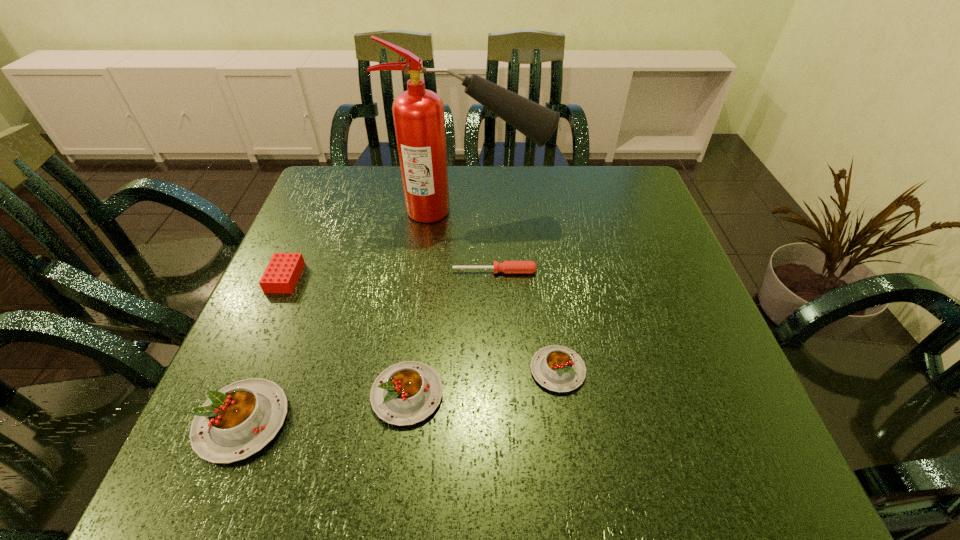
At what (x,y) coordinates should I click in order to perform the action: click on vacant space that's between the shortest object and the shortest pudding. Please return your answer as a coordinate pair (x, y). Looking at the image, I should click on (526, 321).

Locate an element on the screen. free space between the tallest object and the second tallest object is located at coordinates (356, 316).

Identify the location of empty location between the tallest pudding and the second shortest pudding. (324, 408).

Locate an element on the screen. Image resolution: width=960 pixels, height=540 pixels. blank region between the shortest pudding and the shortest object is located at coordinates (526, 321).

Where is `free space between the shortest object and the Lego`? The height and width of the screenshot is (540, 960). free space between the shortest object and the Lego is located at coordinates (390, 274).

I want to click on the closest object to the rightmost pudding, so click(x=405, y=393).

Find the location of `object that is the fifth closest to the tallest object`. object that is the fifth closest to the tallest object is located at coordinates (237, 421).

Find the location of a particular element. This screenshot has width=960, height=540. pudding that is the closest to the leftmost pudding is located at coordinates (405, 393).

You are a GUI agent. You are given a task and a screenshot of the screen. Output one action in this format:
    pyautogui.click(x=<x>, y=<y>)
    Task: Click on the pudding that is the third closest one to the Lego
    
    Given the screenshot: What is the action you would take?
    pyautogui.click(x=557, y=368)

Where is `free spot that satisfies the following two spatial constraints: 1. at the nozzle of the fire extinguisher; 2. on the front side of the second shortest pudding`? The width and height of the screenshot is (960, 540). free spot that satisfies the following two spatial constraints: 1. at the nozzle of the fire extinguisher; 2. on the front side of the second shortest pudding is located at coordinates [x=464, y=394].